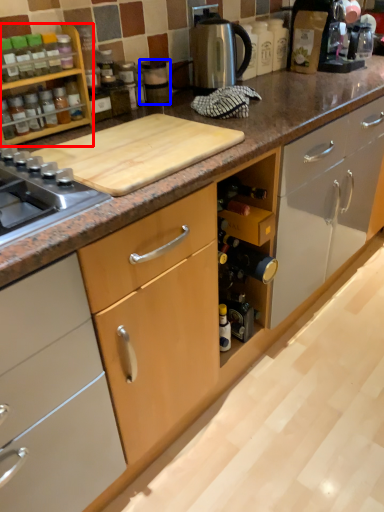
Question: Which object appears closest to the camera in this image, kitchen appliance (highlighted by a red box) or appliance (highlighted by a blue box)?

Choices:
 (A) kitchen appliance
 (B) appliance

Answer: (A)